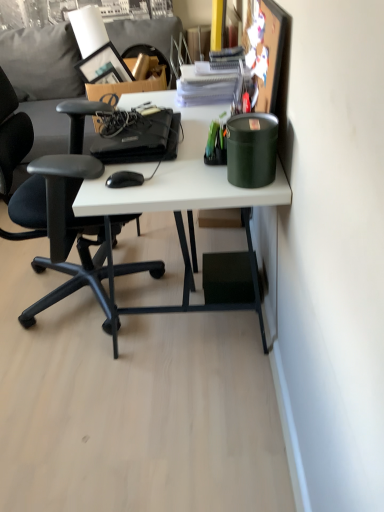
This screenshot has width=384, height=512. What do you see at coordinates (138, 137) in the screenshot? I see `black matte laptop at center` at bounding box center [138, 137].

The image size is (384, 512). What do you see at coordinates (184, 206) in the screenshot?
I see `white matte desk at center` at bounding box center [184, 206].

Describe the element at coordinates (124, 179) in the screenshot. I see `black plastic mouse at center` at that location.

You are a GUI agent. You are given a task and a screenshot of the screen. Output one action in this format:
    pyautogui.click(x=<x>, y=<y>)
    Task: Click on the green matte canister at upper right
    
    Given the screenshot: What is the action you would take?
    pyautogui.click(x=251, y=149)

What are the coordinates of `dark gray fabric couch at upper left` in the screenshot? It's located at click(x=44, y=80).

From the image's perspective, which is below, green matte canister at upper right or white matte desk at center?

white matte desk at center appears lower in the image.

Is the surface of green matte canister at upper right in direct contact with white matte desk at center?

No, green matte canister at upper right is not making contact with white matte desk at center.

How many degrees apart are the facing directions of green matte canister at upper right and white matte desk at center?

0.158 degrees.

Is green matte canister at upper right shorter than black matte laptop at center?

Incorrect, the height of green matte canister at upper right does not fall short of that of black matte laptop at center.

Considering the sizes of objects green matte canister at upper right and black matte laptop at center in the image provided, who is smaller, green matte canister at upper right or black matte laptop at center?

With smaller size is green matte canister at upper right.

Considering the relative positions of green matte canister at upper right and black matte laptop at center in the image provided, is green matte canister at upper right to the left or to the right of black matte laptop at center?

From the image, it's evident that green matte canister at upper right is to the right of black matte laptop at center.

From a real-world perspective, is green matte canister at upper right on top of black matte laptop at center?

Indeed, from a real-world perspective, green matte canister at upper right stands above black matte laptop at center.

Is black matte laptop at center far from green matte canister at upper right?

No, black matte laptop at center is not far from green matte canister at upper right.

From the image's perspective, would you say black matte laptop at center is positioned over green matte canister at upper right?

Correct, black matte laptop at center appears higher than green matte canister at upper right in the image.

Considering the sizes of black matte laptop at center and green matte canister at upper right in the image, is black matte laptop at center bigger or smaller than green matte canister at upper right?

black matte laptop at center is bigger than green matte canister at upper right.

Considering the sizes of objects black matte laptop at center and green matte canister at upper right in the image provided, who is shorter, black matte laptop at center or green matte canister at upper right?

Standing shorter between the two is black matte laptop at center.

Is green matte canister at upper right not inside dark gray fabric couch at upper left?

Yes.

Based on their sizes in the image, would you say green matte canister at upper right is bigger or smaller than dark gray fabric couch at upper left?

green matte canister at upper right is smaller than dark gray fabric couch at upper left.

Consider the image. Measure the distance between green matte canister at upper right and dark gray fabric couch at upper left.

green matte canister at upper right and dark gray fabric couch at upper left are 4.37 feet apart.

Image resolution: width=384 pixels, height=512 pixels. I want to click on stationery on the right of dark gray fabric couch at upper left, so click(x=251, y=149).

How many degrees apart are the facing directions of black plastic mouse at center and white matte desk at center?

The facing directions of black plastic mouse at center and white matte desk at center are 4.7 degrees apart.

In the image, is black plastic mouse at center positioned in front of or behind white matte desk at center?

Clearly, black plastic mouse at center is behind white matte desk at center.

From a real-world perspective, which is physically below, black plastic mouse at center or white matte desk at center?

white matte desk at center.

Considering the sizes of objects black matte laptop at center and black plastic mouse at center in the image provided, who is wider, black matte laptop at center or black plastic mouse at center?

black matte laptop at center is wider.

Consider the image. Is black matte laptop at center taller than black plastic mouse at center?

Yes, black matte laptop at center is taller than black plastic mouse at center.

Could you tell me if black matte laptop at center is turned towards black plastic mouse at center?

No.

Based on the photo, is black matte laptop at center next to black plastic mouse at center and touching it?

They are not placed beside each other.

Considering the positions of objects black plastic mouse at center and dark gray fabric couch at upper left in the image provided, who is behind, black plastic mouse at center or dark gray fabric couch at upper left?

dark gray fabric couch at upper left is more distant.

Based on the photo, considering the relative sizes of black plastic mouse at center and dark gray fabric couch at upper left in the image provided, is black plastic mouse at center thinner than dark gray fabric couch at upper left?

Yes, black plastic mouse at center is thinner than dark gray fabric couch at upper left.

From a real-world perspective, does black plastic mouse at center stand above dark gray fabric couch at upper left?

Yes, from a real-world perspective, black plastic mouse at center is over dark gray fabric couch at upper left

Consider the image. Which is more to the left, black plastic mouse at center or dark gray fabric couch at upper left?

From the viewer's perspective, dark gray fabric couch at upper left appears more on the left side.

Image resolution: width=384 pixels, height=512 pixels. Identify the location of stationery that appears in front of the white matte desk at center. (251, 149).

In order to click on laptop that is under the green matte canister at upper right (from a real-world perspective) in this screenshot , I will do point(138,137).

Estimate the real-world distances between objects in this image. Which object is closer to dark gray fabric couch at upper left, white matte desk at center or black matte laptop at center?

black matte laptop at center is positioned closer to the anchor dark gray fabric couch at upper left.

Based on their spatial positions, is white matte desk at center or black plastic mouse at center further from green matte canister at upper right?

The object further to green matte canister at upper right is white matte desk at center.

Consider the image. From the image, which object appears to be farther from black plastic mouse at center, black matte laptop at center or dark gray fabric couch at upper left?

Based on the image, dark gray fabric couch at upper left appears to be further to black plastic mouse at center.

Considering their positions, is dark gray fabric couch at upper left positioned closer to black plastic mouse at center than white matte desk at center?

Among the two, white matte desk at center is located nearer to black plastic mouse at center.

Based on their spatial positions, is black plastic mouse at center or green matte canister at upper right further from dark gray fabric couch at upper left?

black plastic mouse at center is further to dark gray fabric couch at upper left.

From the image, which object appears to be farther from dark gray fabric couch at upper left, green matte canister at upper right or black plastic mouse at center?

black plastic mouse at center is further to dark gray fabric couch at upper left.

When comparing their distances from black plastic mouse at center, does green matte canister at upper right or white matte desk at center seem further?

white matte desk at center is positioned further to the anchor black plastic mouse at center.

Looking at the image, which one is located closer to dark gray fabric couch at upper left, white matte desk at center or black plastic mouse at center?

white matte desk at center is positioned closer to the anchor dark gray fabric couch at upper left.

Where is `laptop positioned between white matte desk at center and dark gray fabric couch at upper left from near to far`? The image size is (384, 512). laptop positioned between white matte desk at center and dark gray fabric couch at upper left from near to far is located at coordinates (138, 137).

You are a GUI agent. You are given a task and a screenshot of the screen. Output one action in this format:
    pyautogui.click(x=<x>, y=<y>)
    Task: Click on the laptop between green matte canister at upper right and dark gray fabric couch at upper left in the front-back direction
    
    Given the screenshot: What is the action you would take?
    pyautogui.click(x=138, y=137)

In order to click on desk between black plastic mouse at center and green matte canister at upper right from left to right in this screenshot , I will do coord(184,206).

Where is `mouse between black matte laptop at center and white matte desk at center vertically`? The height and width of the screenshot is (512, 384). mouse between black matte laptop at center and white matte desk at center vertically is located at coordinates (124, 179).